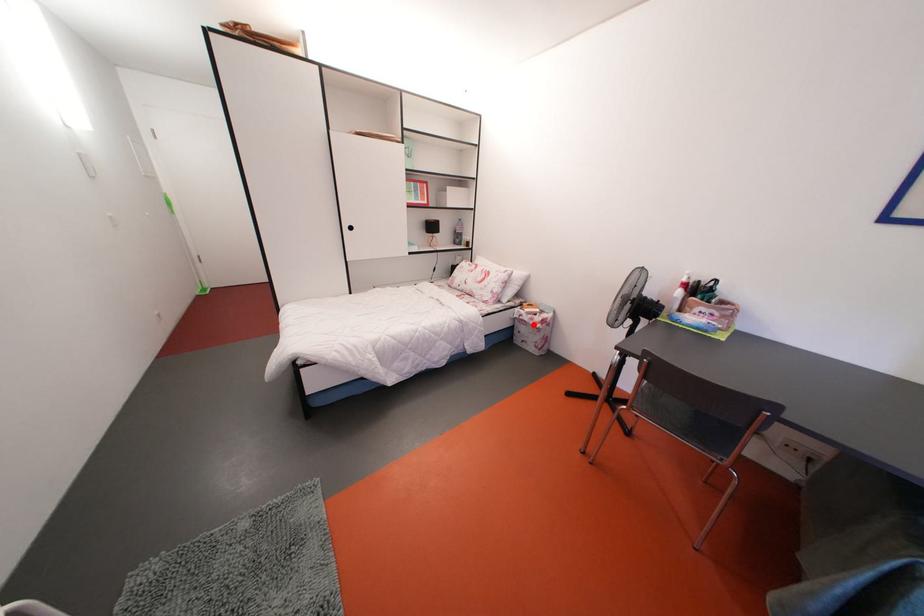
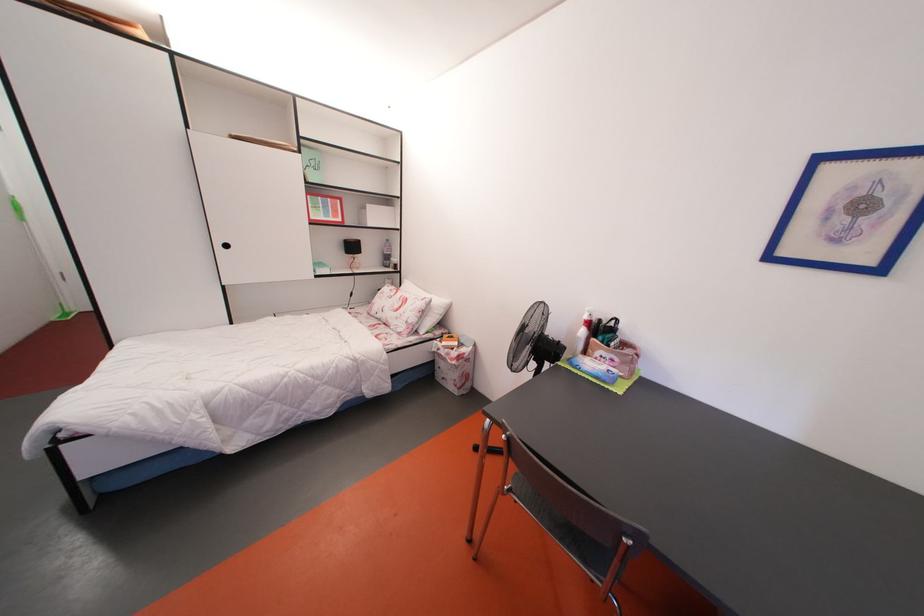
Question: I am providing you with two images of the same scene from different viewpoints. Given a red point in image1, look at the same physical point in image2. Is it:

Choices:
 (A) Closer to the viewpoint
 (B) Farther from the viewpoint

Answer: (B)